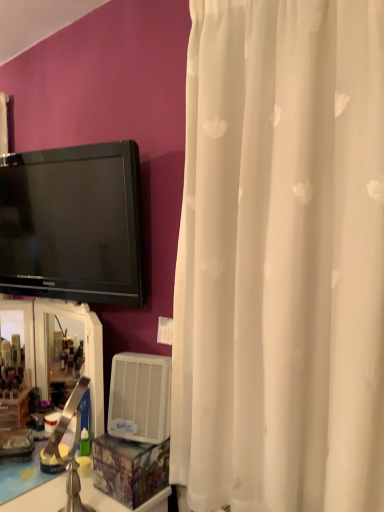
Question: Is white sheer curtain at right inside the boundaries of translucent plastic mirror at lower left, or outside?

Choices:
 (A) outside
 (B) inside

Answer: (A)

Question: In terms of height, does white sheer curtain at right look taller or shorter compared to translucent plastic mirror at lower left?

Choices:
 (A) short
 (B) tall

Answer: (B)

Question: Which is farther from the white sheer curtain at right?

Choices:
 (A) white glossy counter top at lower left
 (B) black glossy tv at upper left
 (C) white plastic air conditioner at lower center
 (D) translucent plastic mirror at lower left
 (E) brushed metal faucet at lower left

Answer: (E)

Question: Considering the real-world distances, which object is closest to the white plastic air conditioner at lower center?

Choices:
 (A) white sheer curtain at right
 (B) translucent plastic mirror at lower left
 (C) brushed metal faucet at lower left
 (D) white glossy counter top at lower left
 (E) black glossy tv at upper left

Answer: (D)